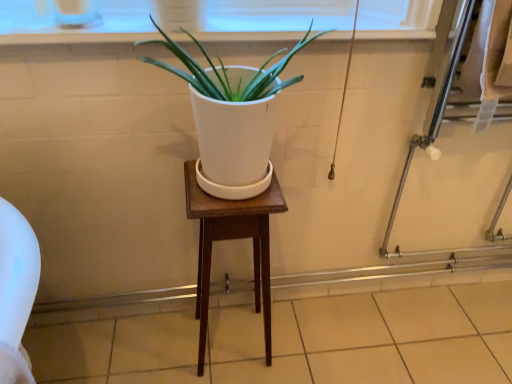
Where is `free region under clear glass screen door at right (from a real-world perspective)`? The image size is (512, 384). free region under clear glass screen door at right (from a real-world perspective) is located at coordinates (425, 305).